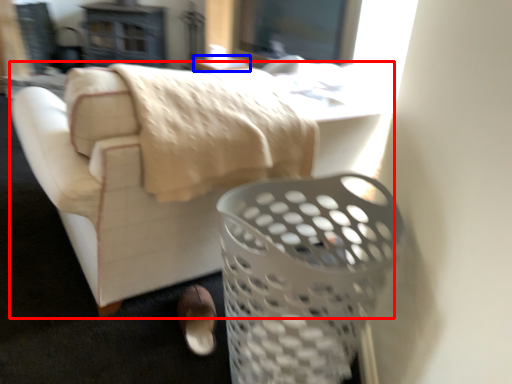
Question: Which point is further to the camera, furniture (highlighted by a red box) or table (highlighted by a blue box)?

Choices:
 (A) furniture
 (B) table

Answer: (B)